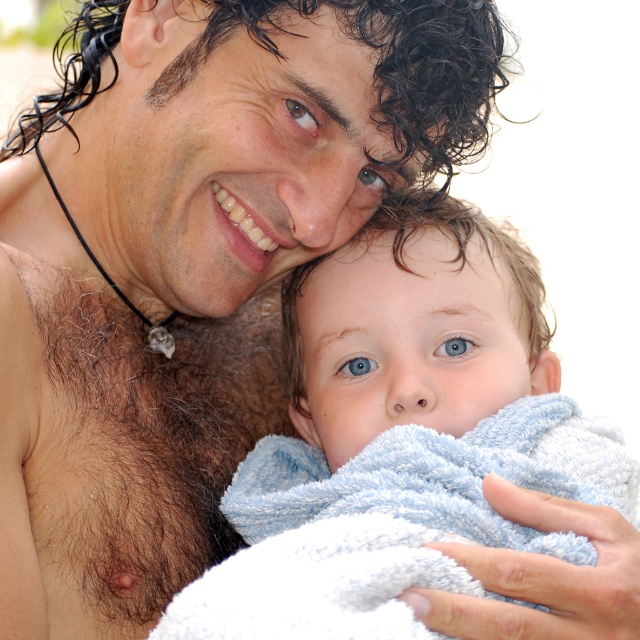
You are a photographer adjusting your camera to focus on two points in the image. The first point is point [372,220] and the second is point [132,435]. Which point is closer to your camera?

Point [372,220] is further to the viewer than point [132,435], so the second point is closer to the camera.

You are a photographer trying to capture the baby in the blue soft towel at center and the adult with hairy skin at left. From the baby and the adult, which one is more to the right side?

The blue soft towel at center is positioned on the right side of hairy skin at left, so the baby in the blue soft towel at center is more to the right side than the adult with hairy skin at left.

You are a photographer standing in front of the scene described. You want to take a photo of the point at coordinates point (580, 436). The focus range of your camera is set to 80 centimeters. Will the point be in focus?

The point (580, 436) is 88.05 centimeters away from the camera, which is beyond the focus range of 80 centimeters. Therefore, the point will not be in focus.